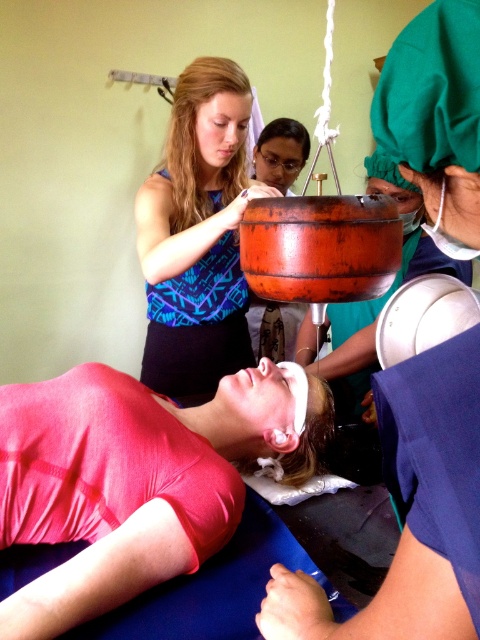
Question: Where is matte orange basin at center located in relation to rustic wooden pot at center in the image?

Choices:
 (A) left
 (B) right

Answer: (B)

Question: Is pink fabric at lower left above blue patterned tank top at upper center?

Choices:
 (A) yes
 (B) no

Answer: (B)

Question: Which is nearer to the pink fabric at lower left?

Choices:
 (A) rustic wooden pot at center
 (B) matte orange basin at center

Answer: (B)

Question: Which of the following is the farthest from the observer?

Choices:
 (A) rustic wooden pot at center
 (B) pink fabric at lower left

Answer: (A)

Question: Can you confirm if matte orange basin at center is smaller than blue patterned tank top at upper center?

Choices:
 (A) yes
 (B) no

Answer: (A)

Question: Estimate the real-world distances between objects in this image. Which object is farther from the blue patterned tank top at upper center?

Choices:
 (A) matte orange basin at center
 (B) pink fabric at lower left

Answer: (A)